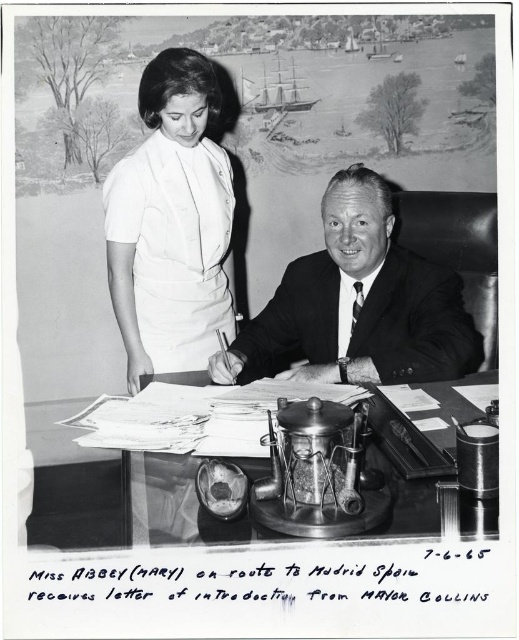
Question: Which object is the farthest from the metallic desk at center?

Choices:
 (A) smooth black suit at center
 (B) white fabric dress at upper left

Answer: (B)

Question: Which object is closer to the camera taking this photo?

Choices:
 (A) white fabric dress at upper left
 (B) metallic desk at center

Answer: (B)

Question: Does white fabric dress at upper left have a lesser width compared to metallic desk at center?

Choices:
 (A) no
 (B) yes

Answer: (B)

Question: Based on their relative distances, which object is farther from the white fabric dress at upper left?

Choices:
 (A) metallic desk at center
 (B) smooth black suit at center

Answer: (A)

Question: Can you confirm if white fabric dress at upper left is wider than metallic desk at center?

Choices:
 (A) yes
 (B) no

Answer: (B)

Question: Is smooth black suit at center above metallic desk at center?

Choices:
 (A) yes
 (B) no

Answer: (A)